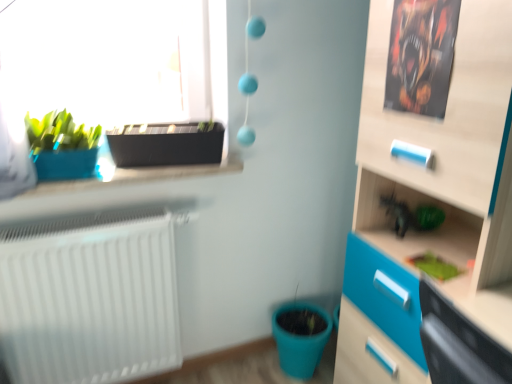
I want to click on black plastic flowerpot at upper left, placed as the 2th flowerpot when sorted from right to left, so click(x=167, y=144).

Where is `green matte plant at lower right`? The width and height of the screenshot is (512, 384). green matte plant at lower right is located at coordinates pos(434,266).

Identify the location of houseplant located in front of the black plastic flowerpot at upper left, the first flowerpot viewed from the top. (62, 146).

Looking at this image, who is shorter, black plastic flowerpot at upper left, arranged as the second flowerpot when viewed from the back, or matte blue pot at left?

Standing shorter between the two is black plastic flowerpot at upper left, arranged as the second flowerpot when viewed from the back.

Considering the positions of objects black plastic flowerpot at upper left, the second flowerpot in the bottom-to-top sequence, and matte blue pot at left in the image provided, who is behind, black plastic flowerpot at upper left, the second flowerpot in the bottom-to-top sequence, or matte blue pot at left?

black plastic flowerpot at upper left, the second flowerpot in the bottom-to-top sequence.

From a real-world perspective, between matte plastic flowerpot at lower center, the 1th flowerpot positioned from the back, and matte blue pot at left, who is vertically higher?

matte blue pot at left, from a real-world perspective.

Can you confirm if matte plastic flowerpot at lower center, the first flowerpot when ordered from bottom to top, is shorter than matte blue pot at left?

In fact, matte plastic flowerpot at lower center, the first flowerpot when ordered from bottom to top, may be taller than matte blue pot at left.

Can you tell me how much matte plastic flowerpot at lower center, the second flowerpot in the top-to-bottom sequence, and matte blue pot at left differ in facing direction?

The angular difference between matte plastic flowerpot at lower center, the second flowerpot in the top-to-bottom sequence, and matte blue pot at left is 90 degrees.

Is matte plastic flowerpot at lower center, the second flowerpot in the top-to-bottom sequence, surrounding matte blue pot at left?

No.

Which of these two, black plastic flowerpot at upper left, the first flowerpot in the left-to-right sequence, or green matte plant at lower right, is smaller?

With smaller size is green matte plant at lower right.

Find the location of a particular element. This screenshot has width=512, height=384. plant below the black plastic flowerpot at upper left, placed as the 2th flowerpot when sorted from right to left (from a real-world perspective) is located at coordinates (434, 266).

Considering the sizes of objects black plastic flowerpot at upper left, placed as the 2th flowerpot when sorted from right to left, and green matte plant at lower right in the image provided, who is wider, black plastic flowerpot at upper left, placed as the 2th flowerpot when sorted from right to left, or green matte plant at lower right?

With larger width is black plastic flowerpot at upper left, placed as the 2th flowerpot when sorted from right to left.

Is black plastic flowerpot at upper left, the second flowerpot in the bottom-to-top sequence, shorter than green matte plant at lower right?

In fact, black plastic flowerpot at upper left, the second flowerpot in the bottom-to-top sequence, may be taller than green matte plant at lower right.

Is green matte plant at lower right facing away from matte plastic flowerpot at lower center, the 1th flowerpot positioned from the back?

That's not correct — green matte plant at lower right is not looking away from matte plastic flowerpot at lower center, the 1th flowerpot positioned from the back.

Which object is further away from the camera taking this photo, green matte plant at lower right or matte plastic flowerpot at lower center, the second flowerpot positioned from the left?

matte plastic flowerpot at lower center, the second flowerpot positioned from the left, is further away from the camera.

Is matte plastic flowerpot at lower center, the first flowerpot when ordered from bottom to top, a part of green matte plant at lower right?

No, matte plastic flowerpot at lower center, the first flowerpot when ordered from bottom to top, is not inside green matte plant at lower right.

Where is `houseplant located on the left of green matte plant at lower right`? The width and height of the screenshot is (512, 384). houseplant located on the left of green matte plant at lower right is located at coordinates tap(62, 146).

Would you say matte blue pot at left is outside green matte plant at lower right?

That's correct, matte blue pot at left is outside of green matte plant at lower right.

Is matte blue pot at left smaller than green matte plant at lower right?

Incorrect, matte blue pot at left is not smaller in size than green matte plant at lower right.

Is matte blue pot at left facing towards green matte plant at lower right?

No, matte blue pot at left is not turned towards green matte plant at lower right.

How many degrees apart are the facing directions of matte plastic flowerpot at lower center, the first flowerpot when ordered from bottom to top, and black plastic flowerpot at upper left, which is counted as the 1th flowerpot, starting from the front?

The angle between the facing direction of matte plastic flowerpot at lower center, the first flowerpot when ordered from bottom to top, and the facing direction of black plastic flowerpot at upper left, which is counted as the 1th flowerpot, starting from the front, is 77.7 degrees.

From the picture: Who is shorter, matte plastic flowerpot at lower center, the first flowerpot when ordered from bottom to top, or black plastic flowerpot at upper left, the first flowerpot in the left-to-right sequence?

Standing shorter between the two is black plastic flowerpot at upper left, the first flowerpot in the left-to-right sequence.

Consider the image. Is black plastic flowerpot at upper left, arranged as the second flowerpot when viewed from the back, inside matte plastic flowerpot at lower center, the second flowerpot in the top-to-bottom sequence?

No, matte plastic flowerpot at lower center, the second flowerpot in the top-to-bottom sequence, does not contain black plastic flowerpot at upper left, arranged as the second flowerpot when viewed from the back.

From a real-world perspective, is matte plastic flowerpot at lower center, the second flowerpot in the top-to-bottom sequence, positioned above or below black plastic flowerpot at upper left, arranged as the second flowerpot when viewed from the back?

matte plastic flowerpot at lower center, the second flowerpot in the top-to-bottom sequence, is situated lower than black plastic flowerpot at upper left, arranged as the second flowerpot when viewed from the back, in the real world.

Based on the photo, who is more distant, matte blue pot at left or matte plastic flowerpot at lower center, the 1th flowerpot positioned from the back?

matte plastic flowerpot at lower center, the 1th flowerpot positioned from the back, is further away from the camera.

From the picture: Looking at the image, does matte blue pot at left seem bigger or smaller compared to matte plastic flowerpot at lower center, which is counted as the first flowerpot, starting from the right?

Clearly, matte blue pot at left is larger in size than matte plastic flowerpot at lower center, which is counted as the first flowerpot, starting from the right.

Between point (63, 142) and point (293, 364), which one is positioned in front?

The point (63, 142) is more forward.

Based on the photo, could you measure the distance between matte blue pot at left and matte plastic flowerpot at lower center, the second flowerpot in the top-to-bottom sequence?

1.05 meters.

At what (x,y) coordinates should I click in order to perform the action: click on houseplant that appears above the black plastic flowerpot at upper left, arranged as the second flowerpot when viewed from the back (from a real-world perspective). Please return your answer as a coordinate pair (x, y). Looking at the image, I should click on (62, 146).

This screenshot has width=512, height=384. I want to click on flowerpot that is the 2nd one when counting rightward from the matte blue pot at left, so click(300, 343).

Considering their positions, is black plastic flowerpot at upper left, the first flowerpot viewed from the top, positioned closer to matte blue pot at left than green matte plant at lower right?

black plastic flowerpot at upper left, the first flowerpot viewed from the top, lies closer to matte blue pot at left than the other object.

Estimate the real-world distances between objects in this image. Which object is closer to black plastic flowerpot at upper left, placed as the 2th flowerpot when sorted from right to left, green matte plant at lower right or matte plastic flowerpot at lower center, the first flowerpot when ordered from bottom to top?

Among the two, green matte plant at lower right is located nearer to black plastic flowerpot at upper left, placed as the 2th flowerpot when sorted from right to left.

Looking at the image, which one is located closer to matte blue pot at left, matte plastic flowerpot at lower center, the first flowerpot when ordered from bottom to top, or black plastic flowerpot at upper left, the first flowerpot in the left-to-right sequence?

black plastic flowerpot at upper left, the first flowerpot in the left-to-right sequence.

From the picture: From the image, which object appears to be farther from black plastic flowerpot at upper left, the first flowerpot viewed from the top, green matte plant at lower right or matte blue pot at left?

green matte plant at lower right.

When comparing their distances from matte blue pot at left, does matte plastic flowerpot at lower center, the first flowerpot when ordered from bottom to top, or green matte plant at lower right seem further?

matte plastic flowerpot at lower center, the first flowerpot when ordered from bottom to top, is further to matte blue pot at left.

Looking at the image, which one is located further to green matte plant at lower right, matte plastic flowerpot at lower center, the second flowerpot positioned from the left, or black plastic flowerpot at upper left, the first flowerpot viewed from the top?

black plastic flowerpot at upper left, the first flowerpot viewed from the top.

Based on the photo, estimate the real-world distances between objects in this image. Which object is closer to matte blue pot at left, black plastic flowerpot at upper left, the first flowerpot in the left-to-right sequence, or matte plastic flowerpot at lower center, the second flowerpot positioned from the left?

Among the two, black plastic flowerpot at upper left, the first flowerpot in the left-to-right sequence, is located nearer to matte blue pot at left.

In the scene shown: When comparing their distances from green matte plant at lower right, does matte blue pot at left or matte plastic flowerpot at lower center, the second flowerpot in the top-to-bottom sequence, seem closer?

matte plastic flowerpot at lower center, the second flowerpot in the top-to-bottom sequence, lies closer to green matte plant at lower right than the other object.

Where is `houseplant between black plastic flowerpot at upper left, arranged as the second flowerpot when viewed from the back, and matte plastic flowerpot at lower center, the second flowerpot positioned from the left, vertically`? This screenshot has width=512, height=384. houseplant between black plastic flowerpot at upper left, arranged as the second flowerpot when viewed from the back, and matte plastic flowerpot at lower center, the second flowerpot positioned from the left, vertically is located at coordinates (62, 146).

In order to click on plant between black plastic flowerpot at upper left, placed as the 2th flowerpot when sorted from right to left, and matte plastic flowerpot at lower center, the 1th flowerpot positioned from the back, vertically in this screenshot , I will do `click(434, 266)`.